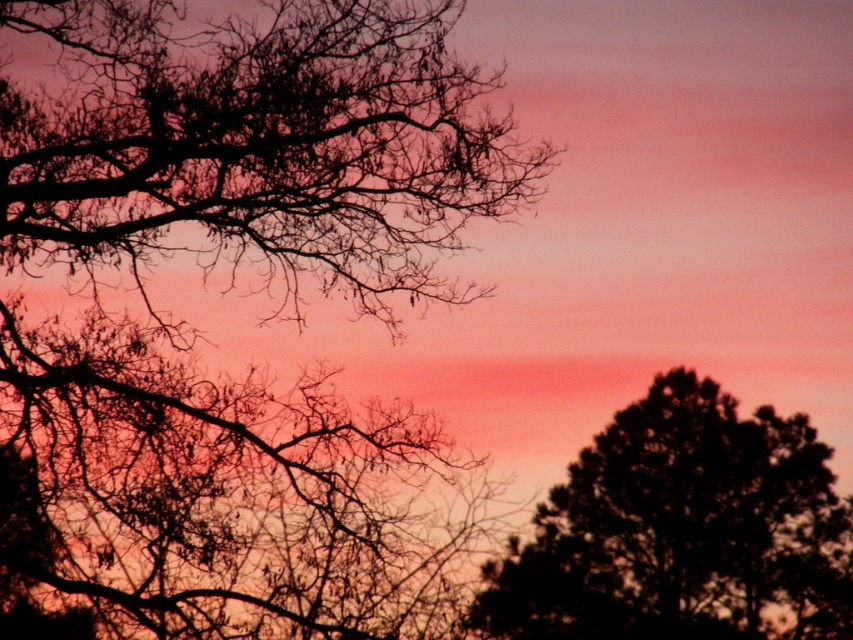
Question: Which point is farther to the camera?

Choices:
 (A) dark green textured tree at right
 (B) silhouette tree at upper left

Answer: (A)

Question: Which point appears farthest from the camera in this image?

Choices:
 (A) 624,561
 (B) 12,556

Answer: (A)

Question: Is silhouette tree at upper left closer to camera compared to dark green textured tree at right?

Choices:
 (A) no
 (B) yes

Answer: (B)

Question: Does silhouette tree at upper left have a lesser width compared to dark green textured tree at right?

Choices:
 (A) no
 (B) yes

Answer: (A)

Question: Is silhouette tree at upper left above dark green textured tree at right?

Choices:
 (A) yes
 (B) no

Answer: (A)